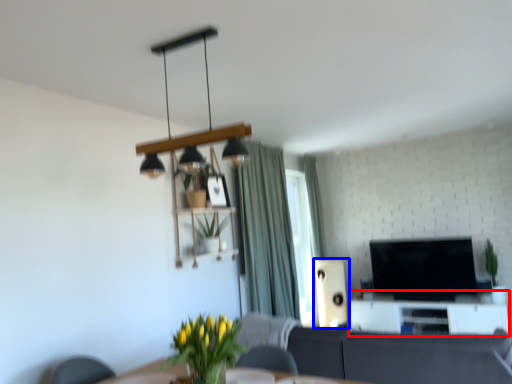
Question: Which of the following is the farthest to the observer, entertainment center (highlighted by a red box) or speaker (highlighted by a blue box)?

Choices:
 (A) entertainment center
 (B) speaker

Answer: (B)